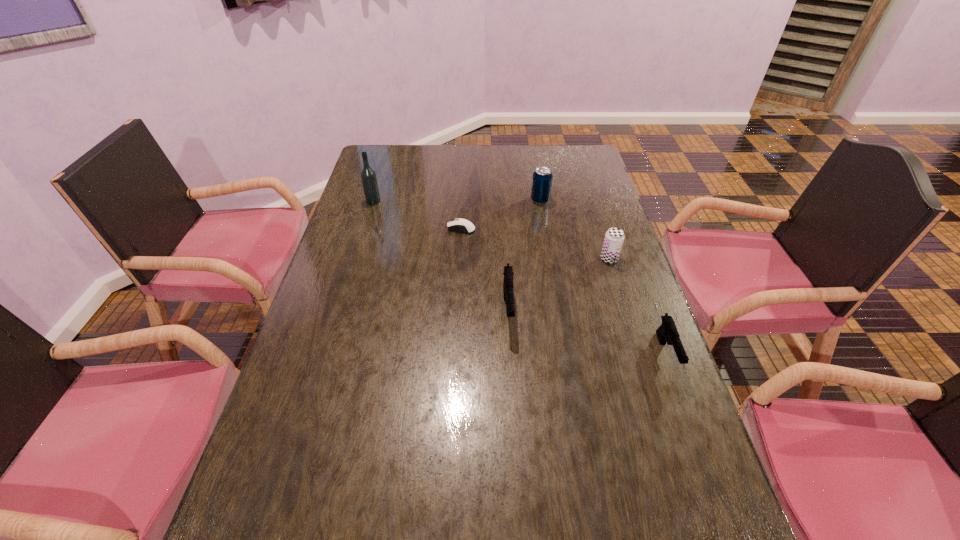
The image size is (960, 540). In the image, there is a desktop. Identify the location of free space at the far edge. (484, 145).

In the image, there is a desktop. Where is `free space at the near edge`? The width and height of the screenshot is (960, 540). free space at the near edge is located at coordinates (372, 489).

I want to click on vacant space at the left edge, so click(396, 200).

Find the location of `free region at the right edge of the desktop`. free region at the right edge of the desktop is located at coordinates (596, 230).

This screenshot has height=540, width=960. In order to click on free space at the far left corner of the desktop in this screenshot , I will do `click(392, 176)`.

Locate an element on the screen. This screenshot has width=960, height=540. empty space that is in between the mouse and the third object from right to left is located at coordinates [501, 214].

This screenshot has width=960, height=540. What are the coordinates of `free spot between the fourth object from left to right and the vodka` in the screenshot? It's located at (457, 201).

This screenshot has width=960, height=540. In order to click on free space between the mouse and the taller pistol in this screenshot , I will do click(485, 269).

Locate an element on the screen. The image size is (960, 540). vacant area between the shortest object and the left pistol is located at coordinates (x=485, y=269).

Locate an element on the screen. The height and width of the screenshot is (540, 960). empty location between the taller pistol and the second object from right to left is located at coordinates (559, 285).